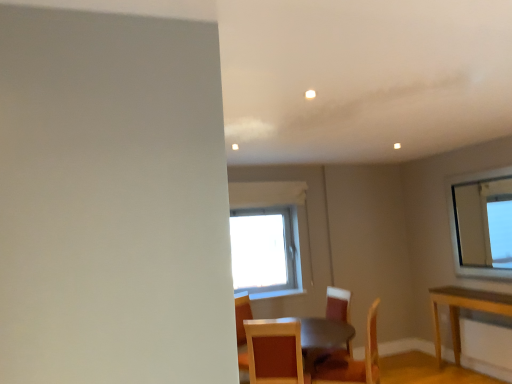
Question: Is wooden chair at center, positioned as the 1th chair in back-to-front order, taller or shorter than wooden textured chair at lower center, which is counted as the first chair, starting from the front?

Choices:
 (A) short
 (B) tall

Answer: (B)

Question: From a real-world perspective, is wooden chair at center, positioned as the 1th chair in back-to-front order, above or below wooden textured chair at lower center, arranged as the third chair when viewed from the back?

Choices:
 (A) above
 (B) below

Answer: (B)

Question: Estimate the real-world distances between objects in this image. Which object is closer to the wooden chair at center, marked as the 2th chair in a front-to-back arrangement?

Choices:
 (A) wooden textured chair at lower center, arranged as the third chair when viewed from the back
 (B) wooden chair at center, positioned as the 1th chair in back-to-front order

Answer: (B)

Question: Which object is positioned farthest from the wooden chair at center, positioned as the 1th chair in back-to-front order?

Choices:
 (A) wooden textured chair at lower center, which is counted as the first chair, starting from the front
 (B) wooden chair at center, which is counted as the 2th chair, starting from the back

Answer: (A)